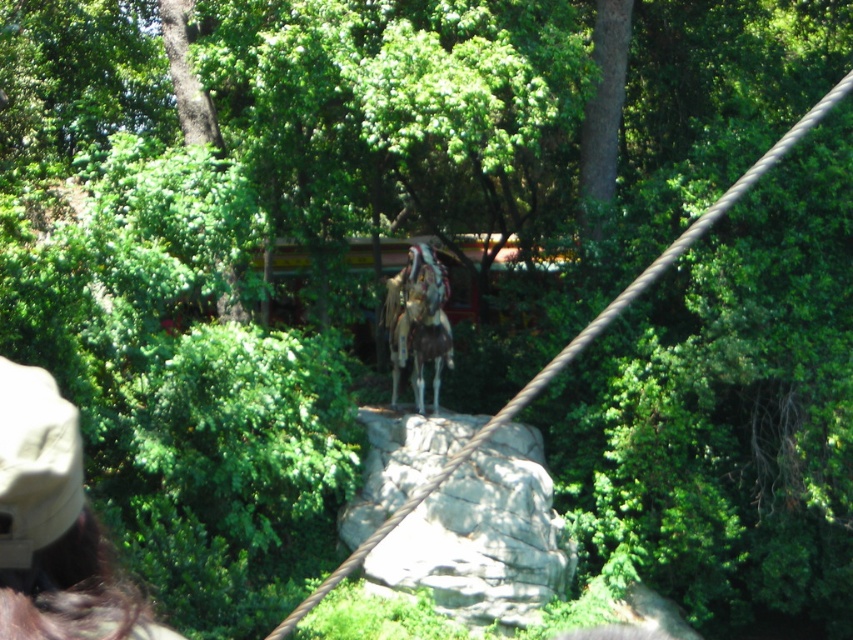
Question: Which point appears farthest from the camera in this image?

Choices:
 (A) (440, 285)
 (B) (78, 538)
 (C) (347, 528)
 (D) (434, 412)

Answer: (D)

Question: Does gray rough rock at center appear on the left side of brown fabric cap at lower left?

Choices:
 (A) no
 (B) yes

Answer: (A)

Question: Can you confirm if gray rough rock at center is wider than brown fabric cap at lower left?

Choices:
 (A) yes
 (B) no

Answer: (A)

Question: Based on their relative distances, which object is farther from the brown fabric cap at lower left?

Choices:
 (A) gray rough rock at center
 (B) leather and fur headdress at center

Answer: (B)

Question: Estimate the real-world distances between objects in this image. Which object is closer to the brown leather horse at center?

Choices:
 (A) gray rough rock at center
 (B) brown fabric cap at lower left

Answer: (A)

Question: Can you confirm if brown fabric cap at lower left is positioned to the left of leather and fur headdress at center?

Choices:
 (A) no
 (B) yes

Answer: (B)